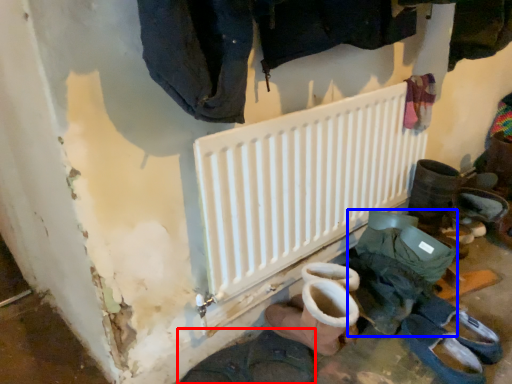
Question: Which object is closer to the camera taking this photo, footwear (highlighted by a red box) or footwear (highlighted by a blue box)?

Choices:
 (A) footwear
 (B) footwear

Answer: (A)